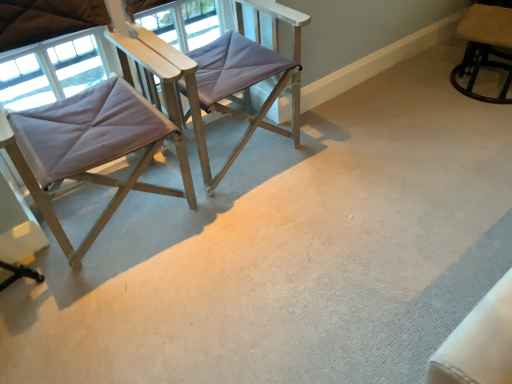
This screenshot has width=512, height=384. I want to click on free point below matte gray fabric chair at left, marked as the first chair in a left-to-right arrangement (from a real-world perspective), so (113, 217).